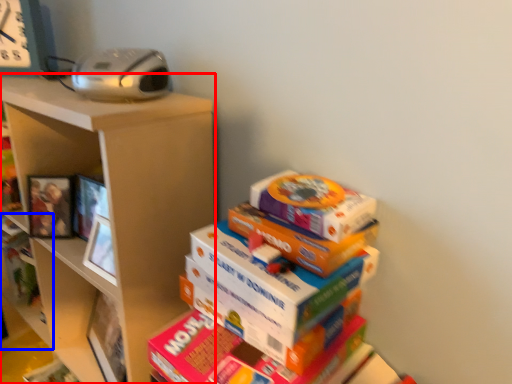
Question: Which point is further to the camera, shelf (highlighted by a red box) or shelf (highlighted by a blue box)?

Choices:
 (A) shelf
 (B) shelf

Answer: (B)